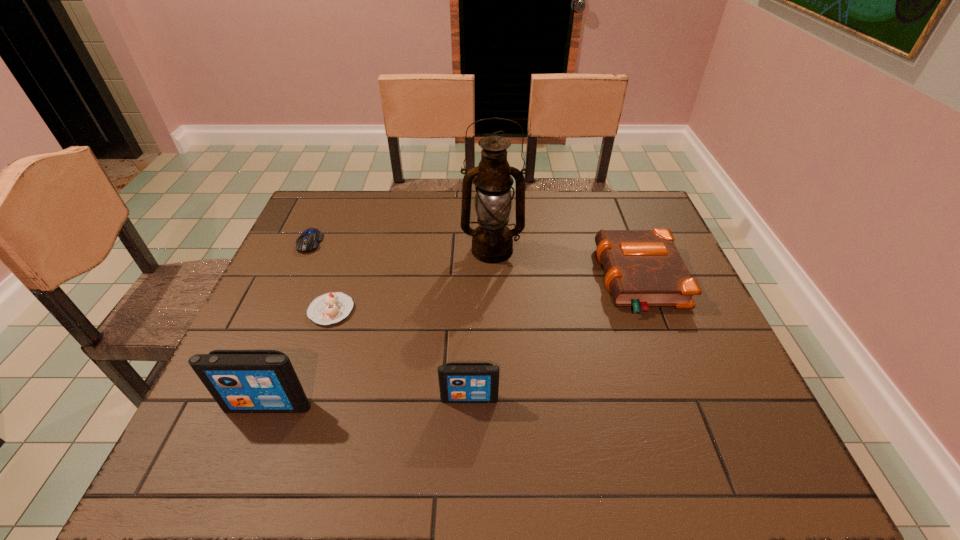
All iPods are currently evenly spaced. To continue this pattern, where would you add another iPod on the right? Please point out a vacant spot. Please provide its 2D coordinates. Your answer should be formatted as a tuple, i.e. [(x, y)], where the tuple contains the x and y coordinates of a point satisfying the conditions above.

[(665, 392)]